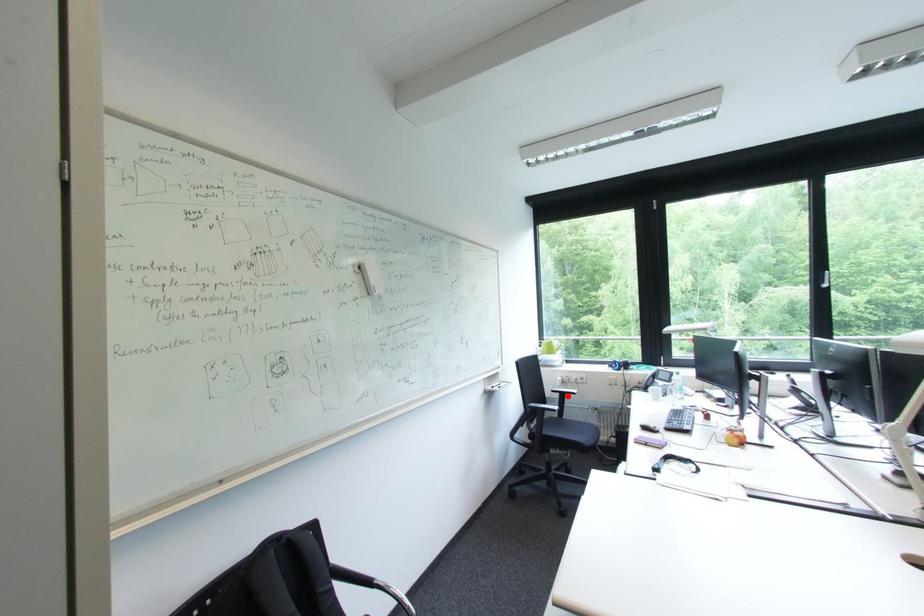
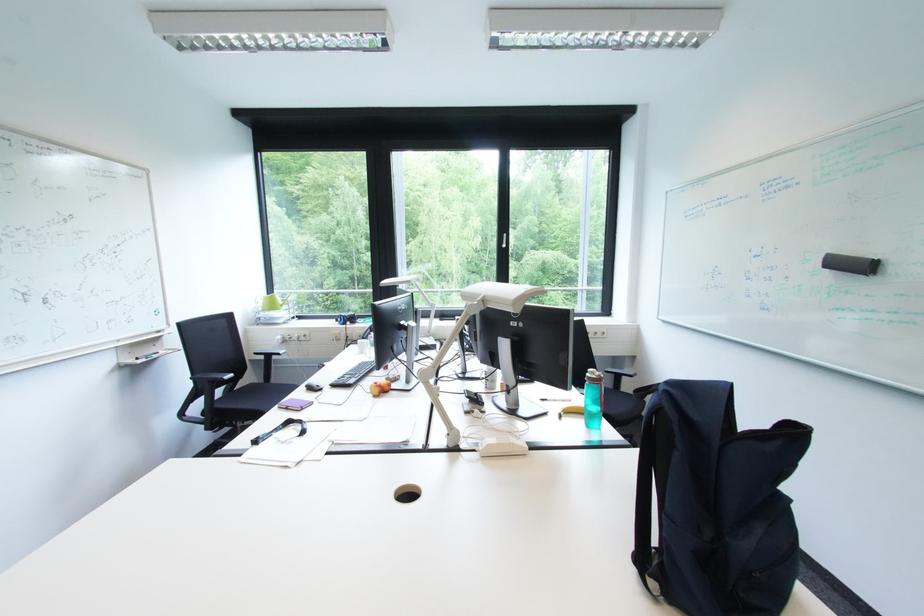
Question: I am providing you with two images of the same scene from different viewpoints. In image1, a red point is highlighted. Considering the same 3D point in image2, which of the following is correct?

Choices:
 (A) It is closer
 (B) It is farther

Answer: (A)